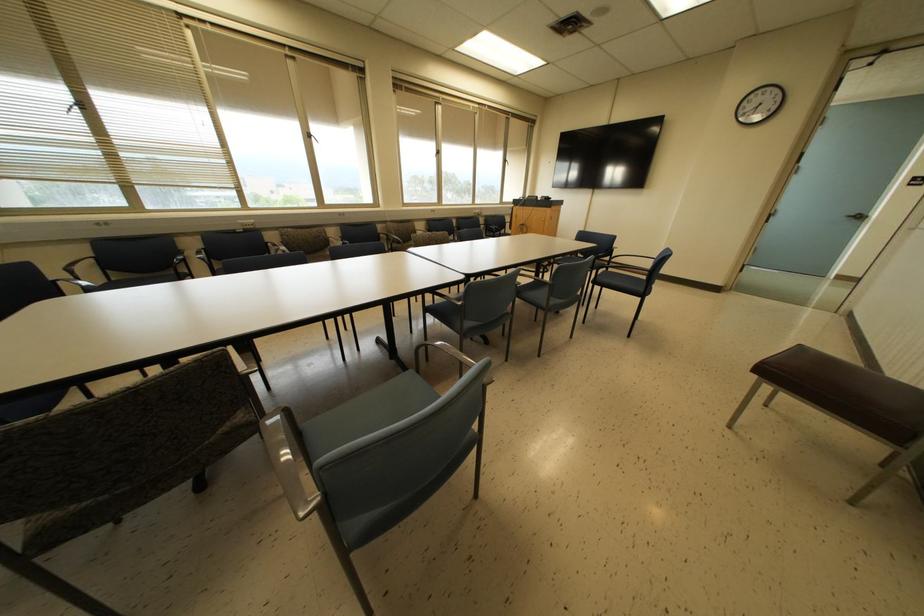
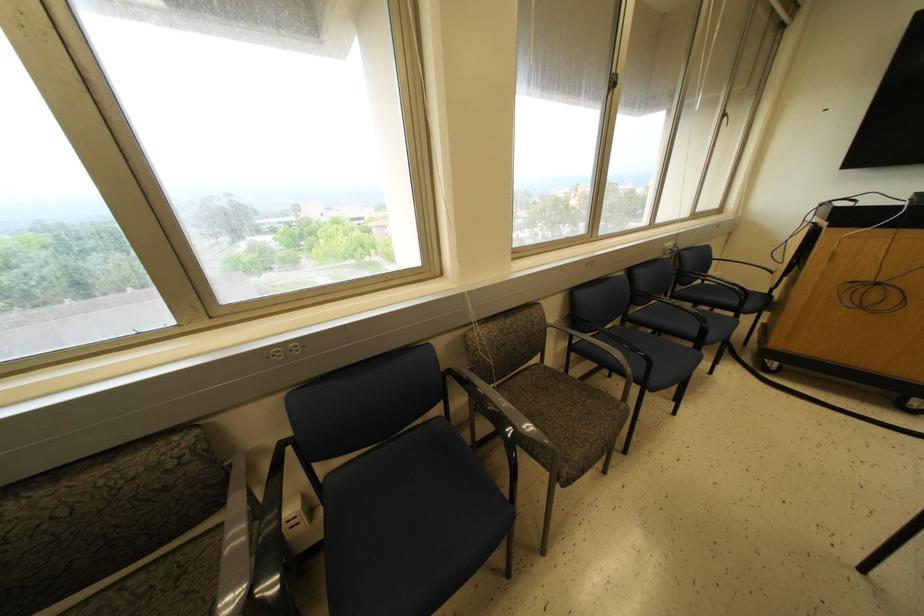
Which direction would the cameraman need to move to produce the second image?

The cameraman walked toward left, forward.